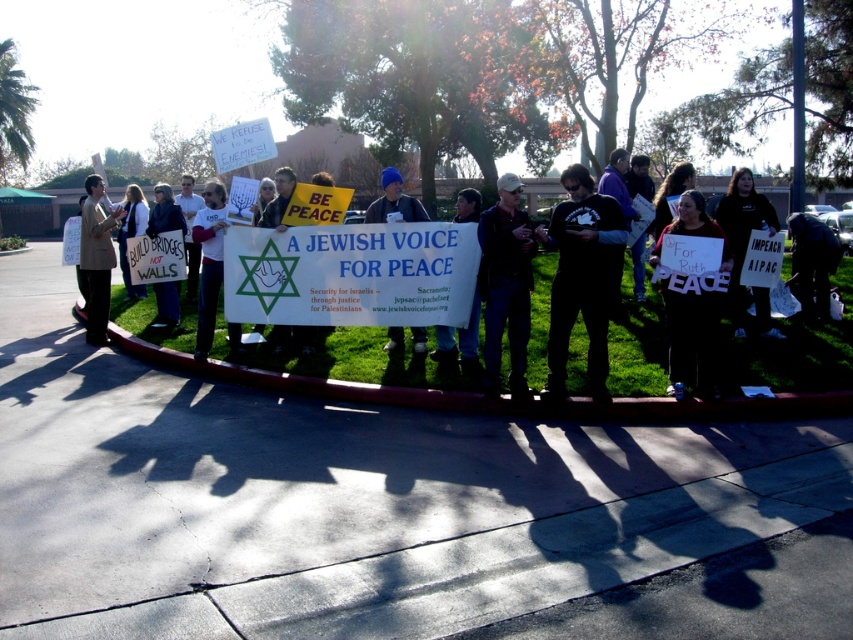
Can you confirm if black t-shirt at center is bigger than white paper sign at center?

Yes, black t-shirt at center is bigger than white paper sign at center.

Where is `black t-shirt at center`? black t-shirt at center is located at coordinates (793, 353).

Which is behind, point (521, 307) or point (201, 276)?

Point (201, 276)

Can you confirm if dark blue jeans at center is positioned below white paper sign at center?

Correct, dark blue jeans at center is located below white paper sign at center.

Does point (514, 396) lie in front of point (201, 296)?

Yes, it is in front of point (201, 296).

The width and height of the screenshot is (853, 640). What are the coordinates of `dark blue jeans at center` in the screenshot? It's located at (506, 284).

Is black cotton shirt at center further to the viewer compared to matte black jacket at center?

No, black cotton shirt at center is in front of matte black jacket at center.

Who is more forward, (570, 205) or (136, 221)?

Point (570, 205)

Identify the location of black cotton shirt at center. The height and width of the screenshot is (640, 853). (581, 276).